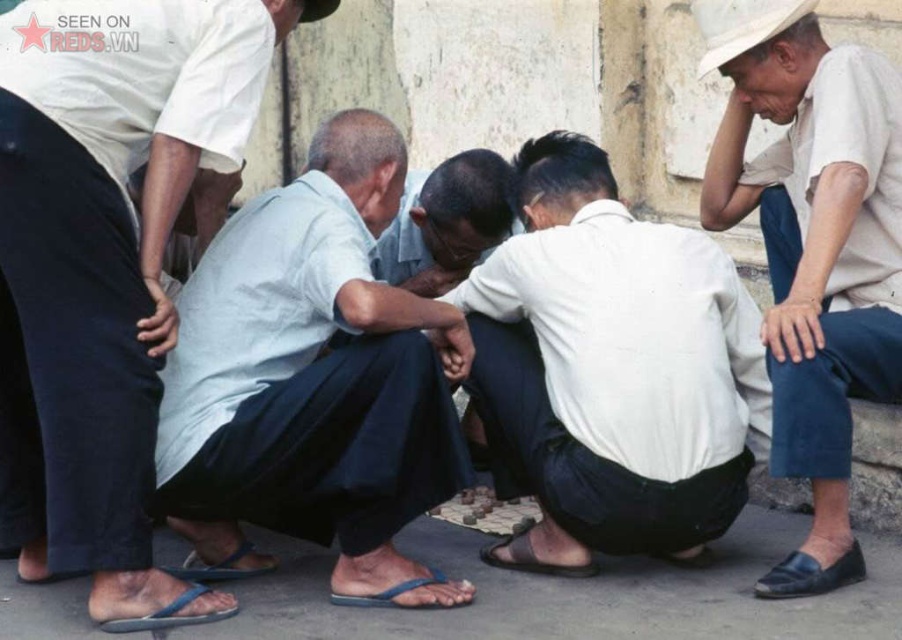
Question: Is blue fabric shirt at left above blue flip-flop at lower center?

Choices:
 (A) yes
 (B) no

Answer: (A)

Question: Is blue fabric shirt at left above blue flip-flop at lower center?

Choices:
 (A) yes
 (B) no

Answer: (A)

Question: Which of these objects is positioned farthest from the black leather sandal at lower center?

Choices:
 (A) blue flip-flop at lower left
 (B) brown leather sandal at lower center
 (C) brown leather sandal at lower left
 (D) blue flip-flop at lower center

Answer: (C)

Question: In this image, where is white cotton shirt at upper right located relative to brown leather sandal at lower left?

Choices:
 (A) right
 (B) left

Answer: (A)

Question: Which point is closer to the camera?

Choices:
 (A) (422, 340)
 (B) (81, 182)

Answer: (B)

Question: Estimate the real-world distances between objects in this image. Which object is closer to the blue flip-flop at lower left?

Choices:
 (A) brown leather sandal at lower center
 (B) brown leather sandal at lower left

Answer: (B)